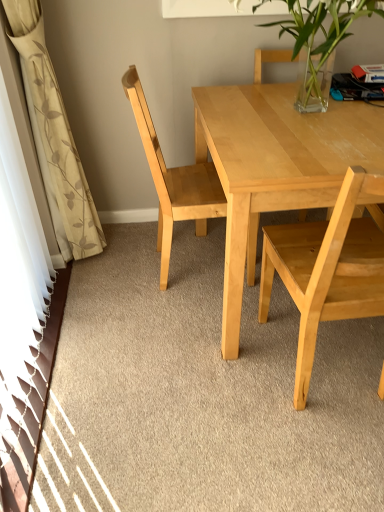
The width and height of the screenshot is (384, 512). Find the location of `free spot above light wood table at center (from a real-world perspective)`. free spot above light wood table at center (from a real-world perspective) is located at coordinates (303, 112).